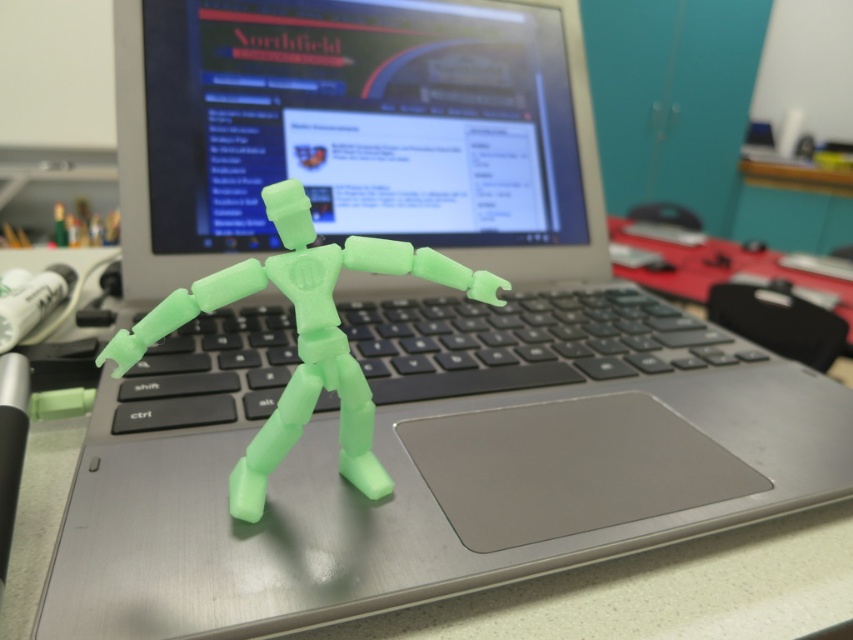
Question: Can you confirm if matte plastic monitor at center is bigger than translucent green plastic figure at center?

Choices:
 (A) yes
 (B) no

Answer: (A)

Question: Which object is the farthest from the matte plastic monitor at center?

Choices:
 (A) black plastic keyboard at center
 (B) translucent green plastic figure at center

Answer: (B)

Question: Is matte plastic monitor at center to the left of black plastic keyboard at center from the viewer's perspective?

Choices:
 (A) yes
 (B) no

Answer: (A)

Question: Which point appears farthest from the camera in this image?

Choices:
 (A) (416, 301)
 (B) (206, 291)
 (C) (187, 54)

Answer: (A)

Question: Which point is farther to the camera?

Choices:
 (A) (259, 90)
 (B) (196, 304)
 (C) (256, 355)

Answer: (A)

Question: Is matte plastic monitor at center closer to the viewer compared to black plastic keyboard at center?

Choices:
 (A) yes
 (B) no

Answer: (B)